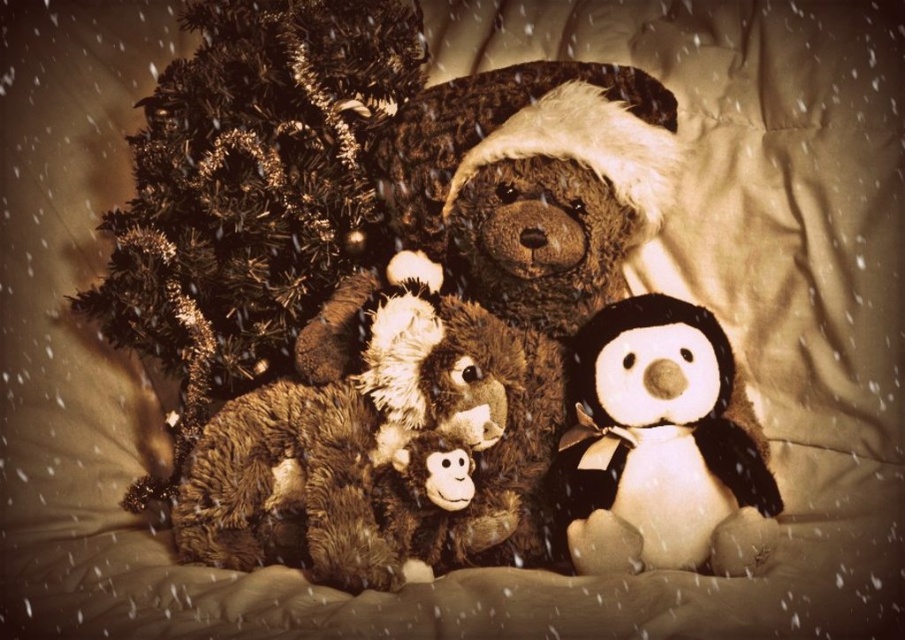
Question: Is fuzzy brown teddy bear at center thinner than white plush penguin at center?

Choices:
 (A) no
 (B) yes

Answer: (A)

Question: Which point is farther to the camera?

Choices:
 (A) (596, 378)
 (B) (341, 333)

Answer: (B)

Question: Which point is closer to the camera?

Choices:
 (A) white plush penguin at center
 (B) fuzzy brown teddy bear at center

Answer: (B)

Question: Does fuzzy brown teddy bear at center appear on the left side of white plush penguin at center?

Choices:
 (A) yes
 (B) no

Answer: (A)

Question: Observing the image, what is the correct spatial positioning of fuzzy brown teddy bear at center in reference to white plush penguin at center?

Choices:
 (A) left
 (B) right

Answer: (A)